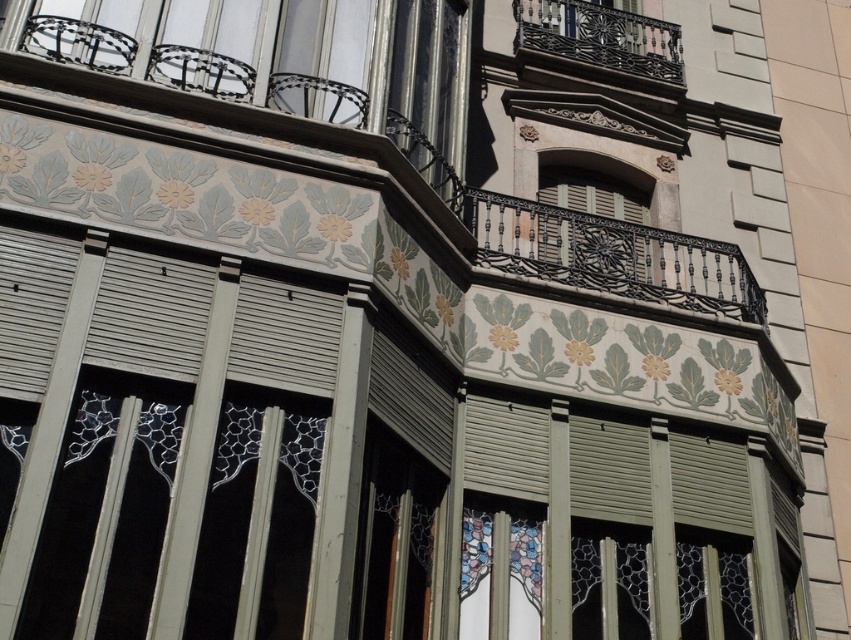
Question: Is black wrought iron balcony at center to the right of dark brown wrought iron balcony at upper center from the viewer's perspective?

Choices:
 (A) no
 (B) yes

Answer: (A)

Question: Is black wrought iron balcony at center smaller than dark brown wrought iron balcony at upper center?

Choices:
 (A) no
 (B) yes

Answer: (A)

Question: Where is black wrought iron balcony at center located in relation to dark brown wrought iron balcony at upper center in the image?

Choices:
 (A) below
 (B) above

Answer: (A)

Question: Among these points, which one is farthest from the camera?

Choices:
 (A) (650, 19)
 (B) (766, 330)

Answer: (A)

Question: Which point is farther to the camera?

Choices:
 (A) dark brown wrought iron balcony at upper center
 (B) black wrought iron balcony at center

Answer: (A)